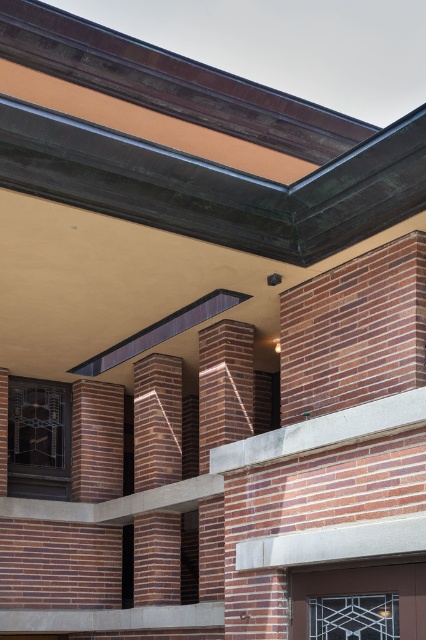
Does point (302, 380) come closer to viewer compared to point (160, 417)?

Yes, point (302, 380) is closer to viewer.

Between red brick wall at upper right and reddish-brown brick pillar at center, which one has less height?

Standing shorter between the two is reddish-brown brick pillar at center.

Which is in front, point (310, 333) or point (181, 387)?

Positioned in front is point (310, 333).

Find the location of a particular element. This screenshot has height=640, width=426. red brick wall at upper right is located at coordinates (354, 332).

Who is shorter, reddish-brown brick pillar at center or red brick pillar at center?

reddish-brown brick pillar at center is shorter.

This screenshot has height=640, width=426. What do you see at coordinates (157, 420) in the screenshot?
I see `reddish-brown brick pillar at center` at bounding box center [157, 420].

Find the location of `reddish-brown brick pillar at center`. reddish-brown brick pillar at center is located at coordinates (157, 420).

Measure the distance from red brick wall at upper right to red brick pillar at center.

A distance of 5.45 feet exists between red brick wall at upper right and red brick pillar at center.

Where is `red brick wall at upper right`? red brick wall at upper right is located at coordinates (354, 332).